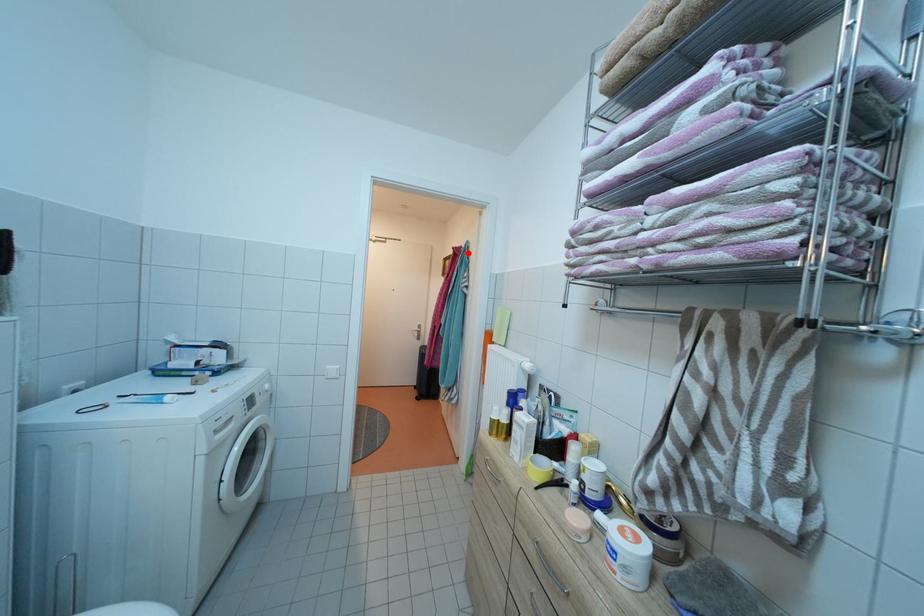
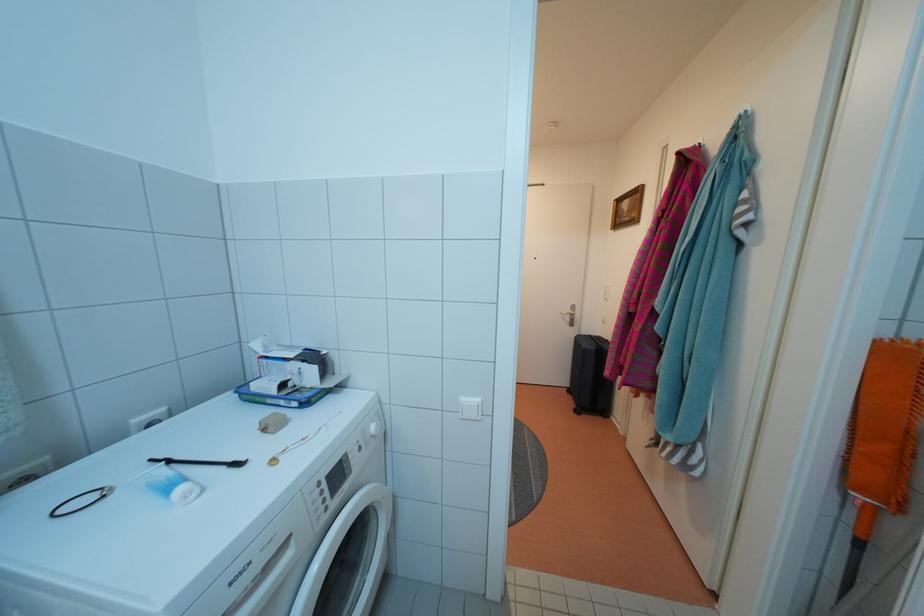
Question: I am providing you with two images of the same scene from different viewpoints. Image1 has a red point marked. In image2, the corresponding 3D location appears at what relative position? Reply with the corresponding letter.

Choices:
 (A) Closer
 (B) Farther

Answer: (B)